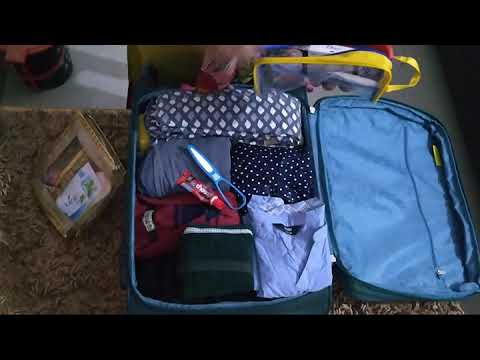
Image resolution: width=480 pixels, height=360 pixels. Identify the location of toiletry bag. (96, 151).